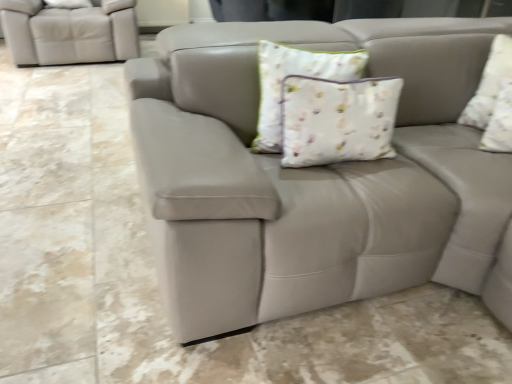
Question: Is matte leather couch at center not inside white floral fabric pillow at upper right, the 2th pillow viewed from the left?

Choices:
 (A) no
 (B) yes

Answer: (B)

Question: Is matte leather couch at center further to camera compared to white floral fabric pillow at upper right, the 2th pillow viewed from the left?

Choices:
 (A) no
 (B) yes

Answer: (A)

Question: Is matte leather couch at center taller than white floral fabric pillow at upper right, arranged as the first pillow when viewed from the right?

Choices:
 (A) no
 (B) yes

Answer: (A)

Question: Is matte leather couch at center oriented towards white floral fabric pillow at upper right, arranged as the first pillow when viewed from the right?

Choices:
 (A) no
 (B) yes

Answer: (A)

Question: Can you confirm if matte leather couch at center is positioned to the right of white floral fabric pillow at upper right, the 2th pillow viewed from the left?

Choices:
 (A) yes
 (B) no

Answer: (B)

Question: Looking at the image, does matte leather couch at center seem bigger or smaller compared to white floral fabric pillow at center, which is the 1th pillow from left to right?

Choices:
 (A) big
 (B) small

Answer: (A)

Question: In the image, is matte leather couch at center positioned in front of or behind white floral fabric pillow at center, the second pillow viewed from the right?

Choices:
 (A) behind
 (B) front

Answer: (B)

Question: Is matte leather couch at center inside or outside of white floral fabric pillow at center, which is the 1th pillow from left to right?

Choices:
 (A) outside
 (B) inside

Answer: (A)

Question: From the image's perspective, is matte leather couch at center located above or below white floral fabric pillow at center, which is the 1th pillow from left to right?

Choices:
 (A) above
 (B) below

Answer: (A)

Question: Would you say white floral fabric pillow at center, the second pillow viewed from the right, is to the left or to the right of white floral fabric pillow at upper right, the 2th pillow viewed from the left, in the picture?

Choices:
 (A) right
 (B) left

Answer: (B)

Question: Is white floral fabric pillow at center, the second pillow viewed from the right, bigger or smaller than white floral fabric pillow at upper right, the 2th pillow viewed from the left?

Choices:
 (A) big
 (B) small

Answer: (A)

Question: From a real-world perspective, is white floral fabric pillow at center, the second pillow viewed from the right, positioned above or below white floral fabric pillow at upper right, arranged as the first pillow when viewed from the right?

Choices:
 (A) below
 (B) above

Answer: (B)

Question: From the image's perspective, is white floral fabric pillow at center, which is the 1th pillow from left to right, positioned above or below white floral fabric pillow at upper right, the 2th pillow viewed from the left?

Choices:
 (A) below
 (B) above

Answer: (A)

Question: Considering the positions of matte leather couch at center and white floral fabric pillow at upper right, arranged as the first pillow when viewed from the right, in the image, is matte leather couch at center bigger or smaller than white floral fabric pillow at upper right, arranged as the first pillow when viewed from the right,?

Choices:
 (A) big
 (B) small

Answer: (A)

Question: Based on their positions, is matte leather couch at center located to the left or right of white floral fabric pillow at upper right, the 2th pillow viewed from the left?

Choices:
 (A) left
 (B) right

Answer: (A)